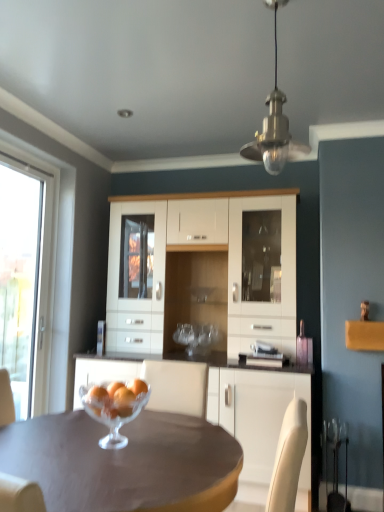
Question: From a real-world perspective, is white glossy cabinet at center located beneath metallic brass pendant light at upper center?

Choices:
 (A) no
 (B) yes

Answer: (B)

Question: Is white glossy cabinet at center aimed at metallic brass pendant light at upper center?

Choices:
 (A) no
 (B) yes

Answer: (B)

Question: From the image's perspective, is white glossy cabinet at center beneath metallic brass pendant light at upper center?

Choices:
 (A) no
 (B) yes

Answer: (B)

Question: Is white glossy cabinet at center behind metallic brass pendant light at upper center?

Choices:
 (A) no
 (B) yes

Answer: (B)

Question: Does white glossy cabinet at center lie in front of metallic brass pendant light at upper center?

Choices:
 (A) no
 (B) yes

Answer: (A)

Question: From a real-world perspective, does white glossy cabinet at center stand above metallic brass pendant light at upper center?

Choices:
 (A) yes
 (B) no

Answer: (B)

Question: From the image's perspective, is matte brown table at center beneath white glossy cabinet at center?

Choices:
 (A) no
 (B) yes

Answer: (B)

Question: Considering the relative positions of matte brown table at center and white glossy cabinet at center in the image provided, is matte brown table at center to the right of white glossy cabinet at center from the viewer's perspective?

Choices:
 (A) no
 (B) yes

Answer: (A)

Question: From a real-world perspective, is matte brown table at center over white glossy cabinet at center?

Choices:
 (A) yes
 (B) no

Answer: (B)

Question: Would you say white glossy cabinet at center is part of matte brown table at center's contents?

Choices:
 (A) no
 (B) yes

Answer: (A)

Question: Is matte brown table at center positioned behind white glossy cabinet at center?

Choices:
 (A) yes
 (B) no

Answer: (B)

Question: Is matte brown table at center completely or partially outside of white glossy cabinet at center?

Choices:
 (A) yes
 (B) no

Answer: (A)

Question: Can metallic brass pendant light at upper center be found inside white glossy cabinet at center?

Choices:
 (A) no
 (B) yes

Answer: (A)